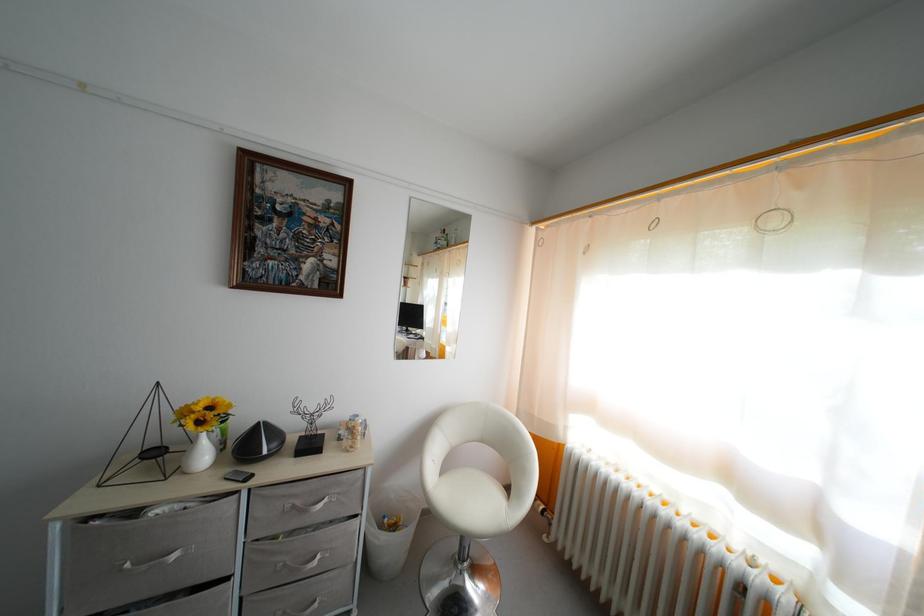
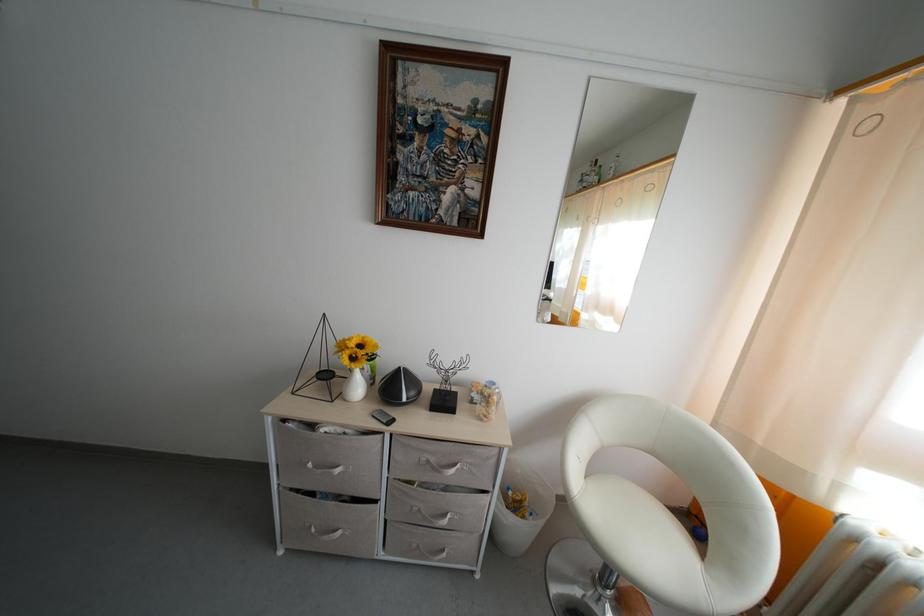
Find the pixel in the second image that matches [161,459] in the first image.

(332, 382)